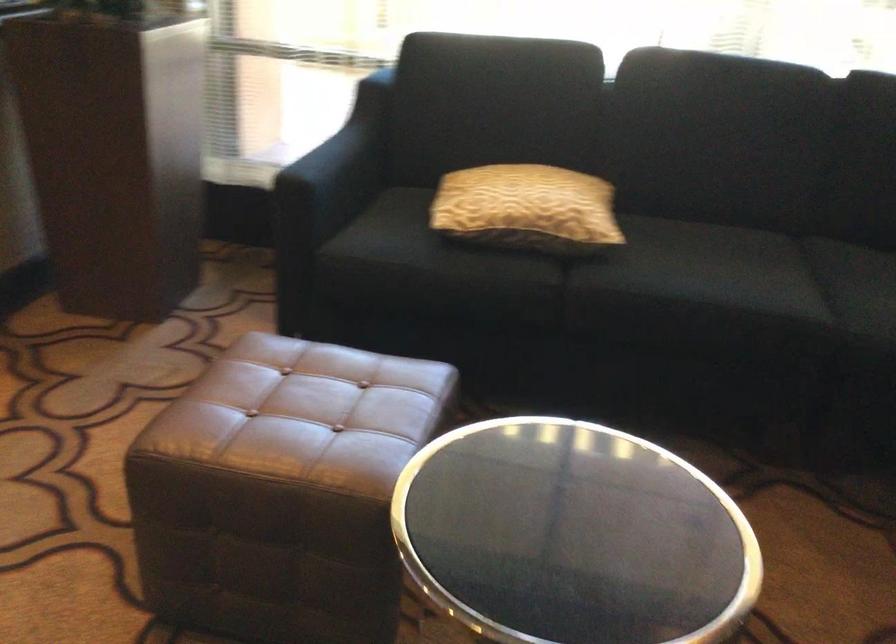
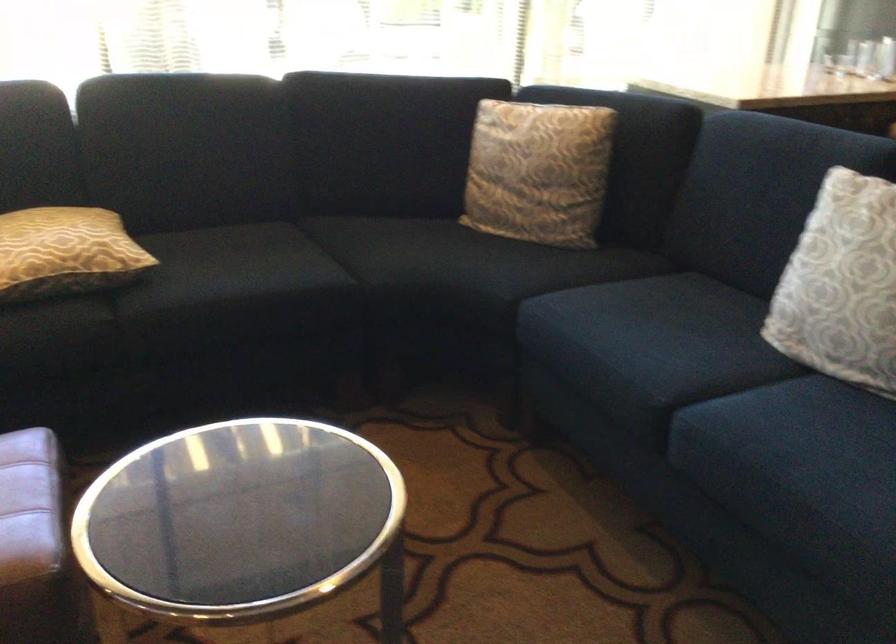
In the second image, find the point that corresponds to point (536, 211) in the first image.

(65, 252)